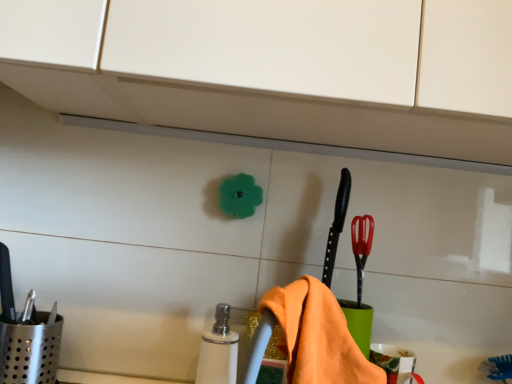
Question: From the image's perspective, does red plastic brush at right appear higher than orange cotton towel at lower center?

Choices:
 (A) no
 (B) yes

Answer: (B)

Question: Is red plastic brush at right facing towards orange cotton towel at lower center?

Choices:
 (A) no
 (B) yes

Answer: (A)

Question: Would you say red plastic brush at right is outside orange cotton towel at lower center?

Choices:
 (A) no
 (B) yes

Answer: (B)

Question: Is the position of red plastic brush at right more distant than that of orange cotton towel at lower center?

Choices:
 (A) no
 (B) yes

Answer: (B)

Question: Considering the relative positions of red plastic brush at right and orange cotton towel at lower center in the image provided, is red plastic brush at right to the left of orange cotton towel at lower center from the viewer's perspective?

Choices:
 (A) no
 (B) yes

Answer: (A)

Question: Is point (357, 220) positioned closer to the camera than point (202, 344)?

Choices:
 (A) closer
 (B) farther

Answer: (B)

Question: Which is correct: red plastic brush at right is inside white glossy soap dispenser at center, or outside of it?

Choices:
 (A) outside
 (B) inside

Answer: (A)

Question: In terms of height, does red plastic brush at right look taller or shorter compared to white glossy soap dispenser at center?

Choices:
 (A) short
 (B) tall

Answer: (A)

Question: From the image's perspective, relative to white glossy soap dispenser at center, is red plastic brush at right above or below?

Choices:
 (A) above
 (B) below

Answer: (A)

Question: From the image's perspective, is orange cotton towel at lower center above or below red plastic brush at right?

Choices:
 (A) above
 (B) below

Answer: (B)

Question: Visually, is orange cotton towel at lower center positioned to the left or to the right of red plastic brush at right?

Choices:
 (A) right
 (B) left

Answer: (B)

Question: In terms of height, does orange cotton towel at lower center look taller or shorter compared to red plastic brush at right?

Choices:
 (A) short
 (B) tall

Answer: (B)

Question: In the image, is orange cotton towel at lower center positioned in front of or behind red plastic brush at right?

Choices:
 (A) behind
 (B) front

Answer: (B)

Question: Is red plastic brush at right in front of or behind orange cotton towel at lower center in the image?

Choices:
 (A) front
 (B) behind

Answer: (B)

Question: From the image's perspective, is red plastic brush at right above or below orange cotton towel at lower center?

Choices:
 (A) below
 (B) above

Answer: (B)